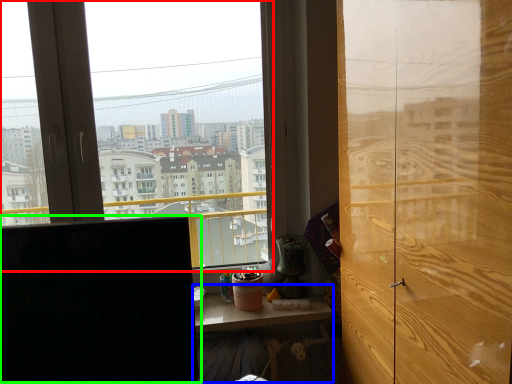
Question: Based on their relative distances, which object is nearer to window (highlighted by a red box)? Choose from table (highlighted by a blue box) and computer monitor (highlighted by a green box).

Choices:
 (A) table
 (B) computer monitor

Answer: (A)